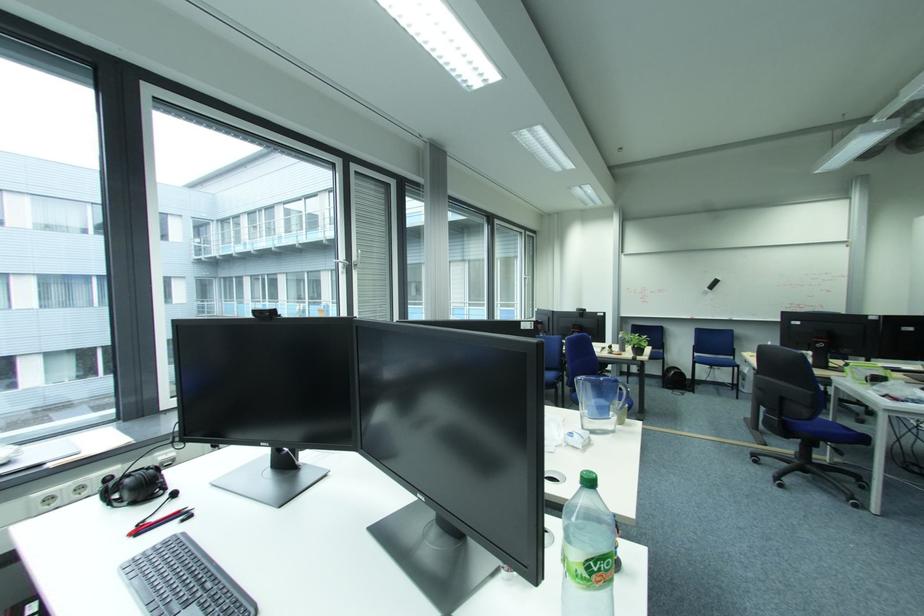
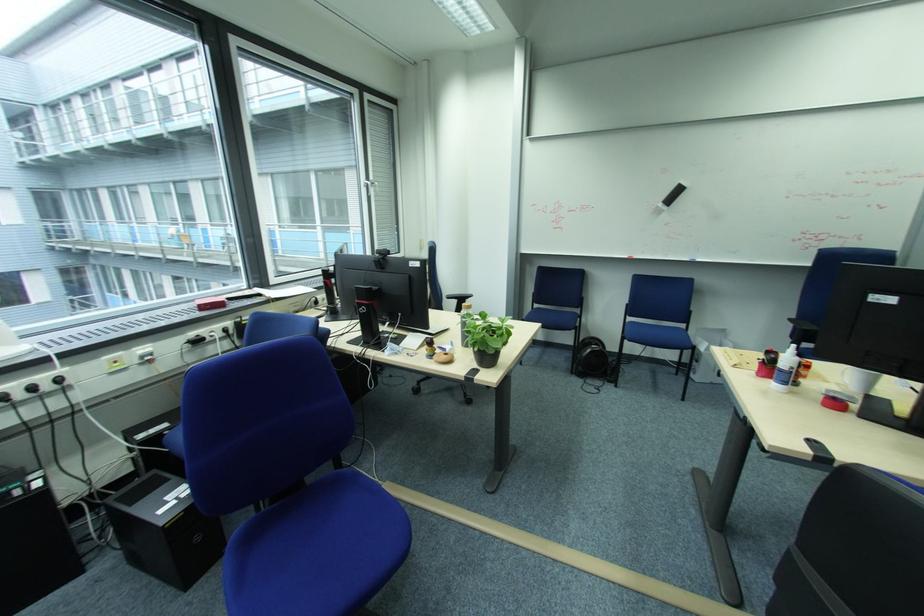
Locate, in the second image, the point that corresponds to (x=703, y=363) in the first image.

(633, 339)